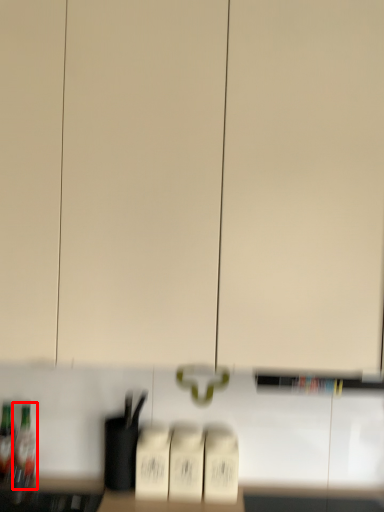
Question: In this image, where is bottle (annotated by the red box) located relative to bottle?

Choices:
 (A) left
 (B) right

Answer: (B)